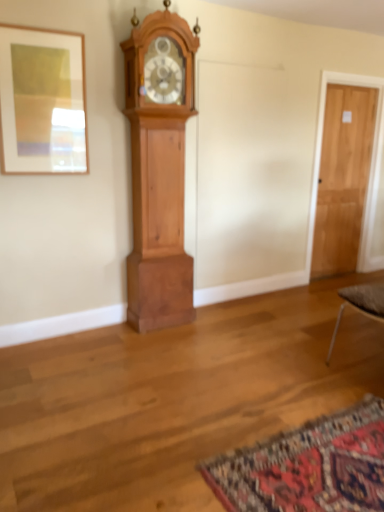
Question: Looking at their shapes, would you say cherry wood grandfather clock at left is wider or thinner than matte wood picture frame at upper left?

Choices:
 (A) wide
 (B) thin

Answer: (A)

Question: Is point (150, 309) closer or farther from the camera than point (59, 138)?

Choices:
 (A) farther
 (B) closer

Answer: (A)

Question: Which object is positioned closest to the matte wood picture frame at upper left?

Choices:
 (A) light brown wooden door at right
 (B) carpeted mat at lower right
 (C) cherry wood grandfather clock at left

Answer: (C)

Question: Based on their relative distances, which object is farther from the carpeted mat at lower right?

Choices:
 (A) light brown wooden door at right
 (B) matte wood picture frame at upper left
 (C) cherry wood grandfather clock at left

Answer: (A)